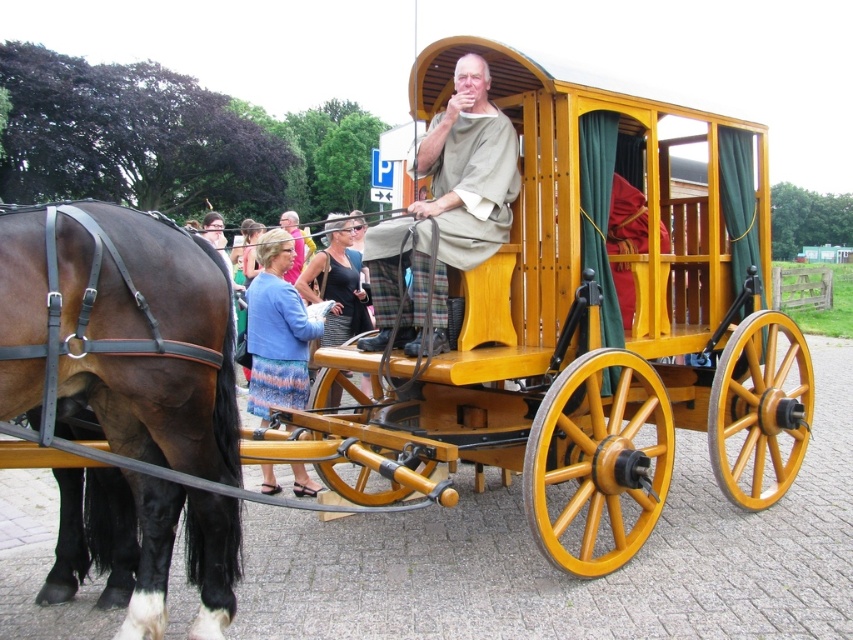
Can you confirm if brown leather harness at left is thinner than beige fabric robe at center?

Indeed, brown leather harness at left has a lesser width compared to beige fabric robe at center.

In the scene shown: Who is more distant from viewer, (170, 260) or (462, 184)?

The point (462, 184) is more distant.

Is point (187, 352) positioned after point (453, 256)?

No, (187, 352) is closer to viewer.

Where is `brown leather harness at left`? This screenshot has height=640, width=853. brown leather harness at left is located at coordinates (120, 332).

Does beige fabric robe at center appear under blue fabric dress at lower left?

No, beige fabric robe at center is not below blue fabric dress at lower left.

Locate an element on the screen. beige fabric robe at center is located at coordinates (445, 211).

The image size is (853, 640). In order to click on brown leather harness at left in this screenshot , I will do `click(120, 332)`.

Between point (107, 384) and point (292, 288), which one is positioned behind?

Point (292, 288)

Identify the location of brown leather harness at left. (120, 332).